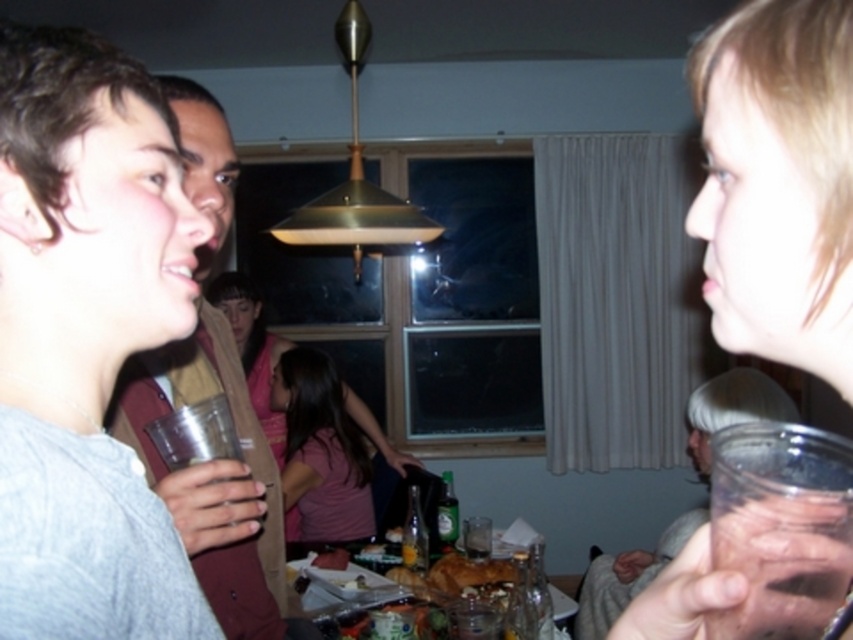
Does gray knit sweater at left have a greater width compared to pink fabric shirt at center?

In fact, gray knit sweater at left might be narrower than pink fabric shirt at center.

I want to click on gray knit sweater at left, so click(85, 339).

You are a GUI agent. You are given a task and a screenshot of the screen. Output one action in this format:
    pyautogui.click(x=<x>, y=<y>)
    Task: Click on the gray knit sweater at left
    This screenshot has height=640, width=853.
    Given the screenshot: What is the action you would take?
    pyautogui.click(x=85, y=339)

Does translucent plastic cup at lower right appear on the left side of pink fabric shirt at center?

In fact, translucent plastic cup at lower right is to the right of pink fabric shirt at center.

Looking at this image, is the position of translucent plastic cup at lower right more distant than that of pink fabric shirt at center?

That is False.

Between point (699, 420) and point (305, 348), which one is positioned in front?

Point (699, 420) is more forward.

Where is `translucent plastic cup at lower right`? Image resolution: width=853 pixels, height=640 pixels. translucent plastic cup at lower right is located at coordinates (627, 577).

Which is more to the left, translucent plastic cup at upper right or translucent plastic cup at lower right?

Positioned to the left is translucent plastic cup at upper right.

Between translucent plastic cup at upper right and translucent plastic cup at lower right, which one appears on the right side from the viewer's perspective?

From the viewer's perspective, translucent plastic cup at lower right appears more on the right side.

Between point (712, 68) and point (637, 550), which one is positioned behind?

The point (637, 550) is more distant.

What are the coordinates of `translucent plastic cup at upper right` in the screenshot? It's located at (778, 182).